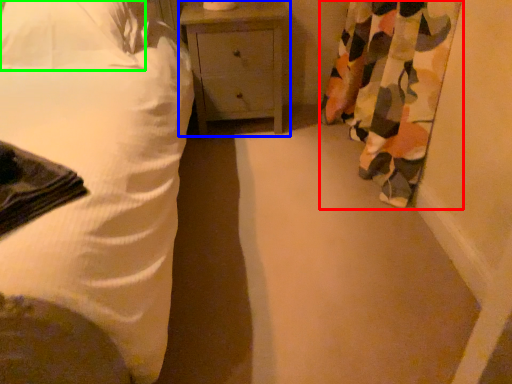
Question: Which object is positioned closest to curtain (highlighted by a red box)? Select from nightstand (highlighted by a blue box) and pillow (highlighted by a green box).

Choices:
 (A) nightstand
 (B) pillow

Answer: (A)